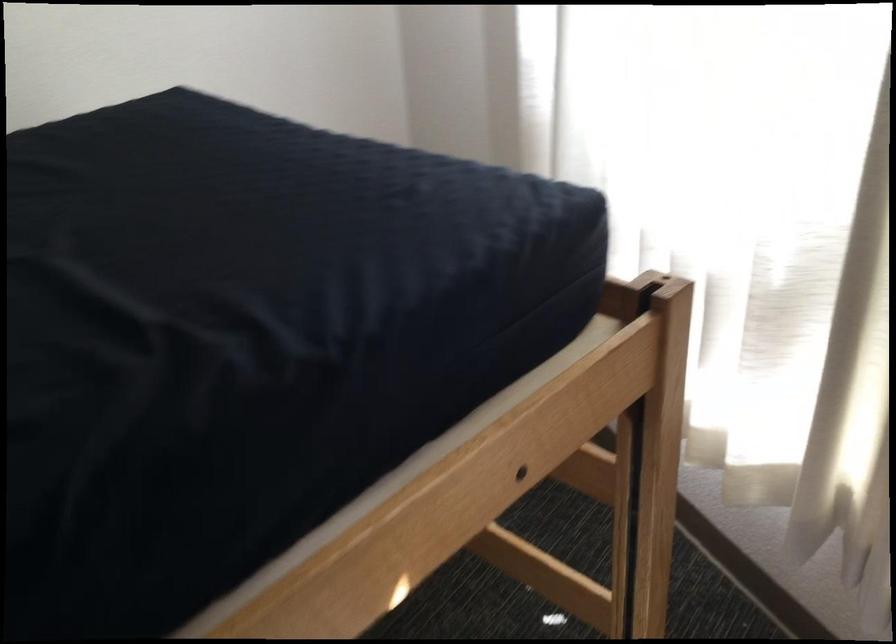
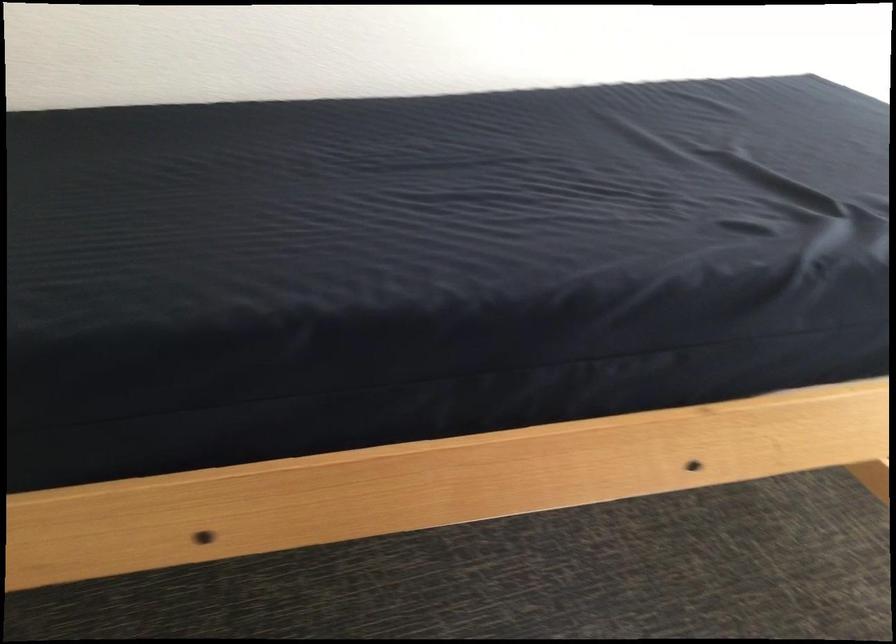
Question: The camera is either moving clockwise (left) or counter-clockwise (right) around the object. The first image is from the beginning of the video and the second image is from the end. Is the camera moving left or right when shooting the video?

Choices:
 (A) Left
 (B) Right

Answer: (B)